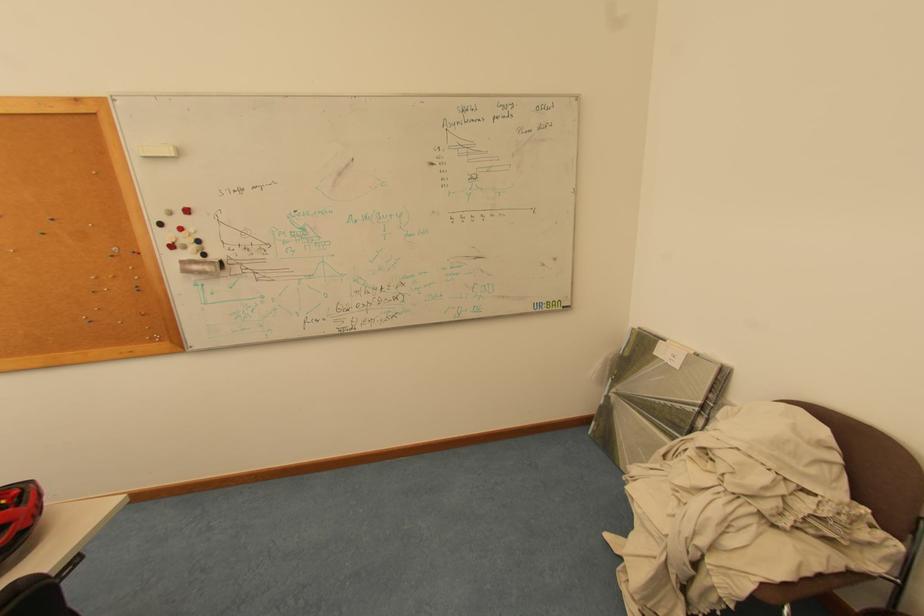
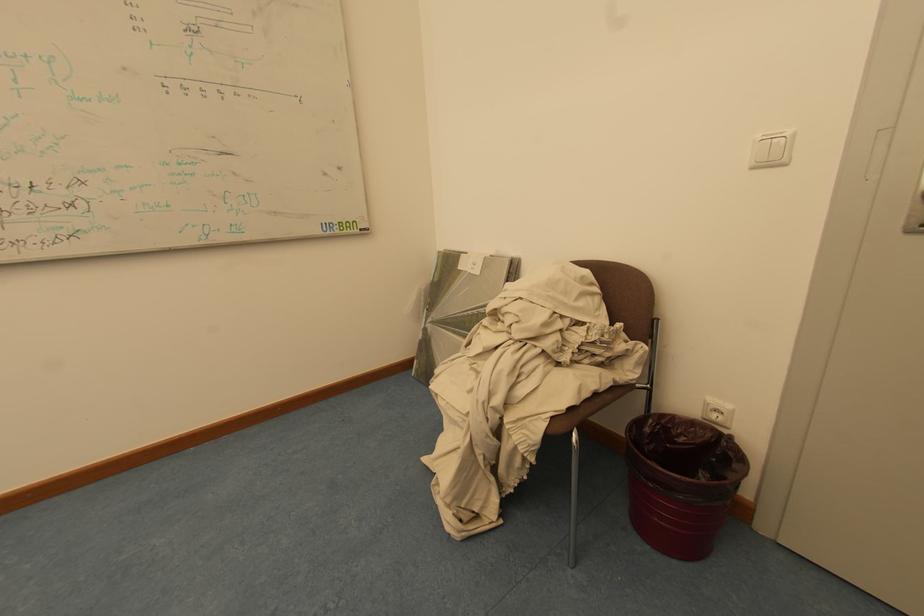
Question: Based on the continuous images, in which direction is the camera rotating? Reply with the corresponding letter.

Choices:
 (A) Left
 (B) Right
 (C) Up
 (D) Down

Answer: (B)